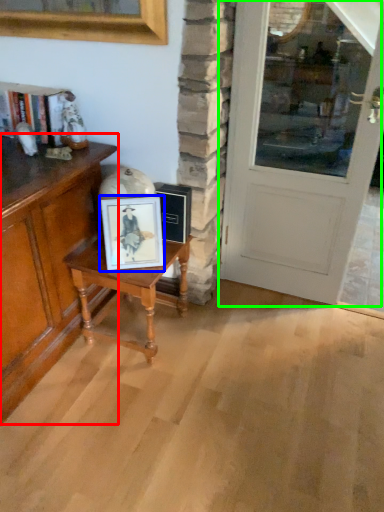
Question: Which is farther away from cabinetry (highlighted by a red box)? picture frame (highlighted by a blue box) or door (highlighted by a green box)?

Choices:
 (A) picture frame
 (B) door

Answer: (B)